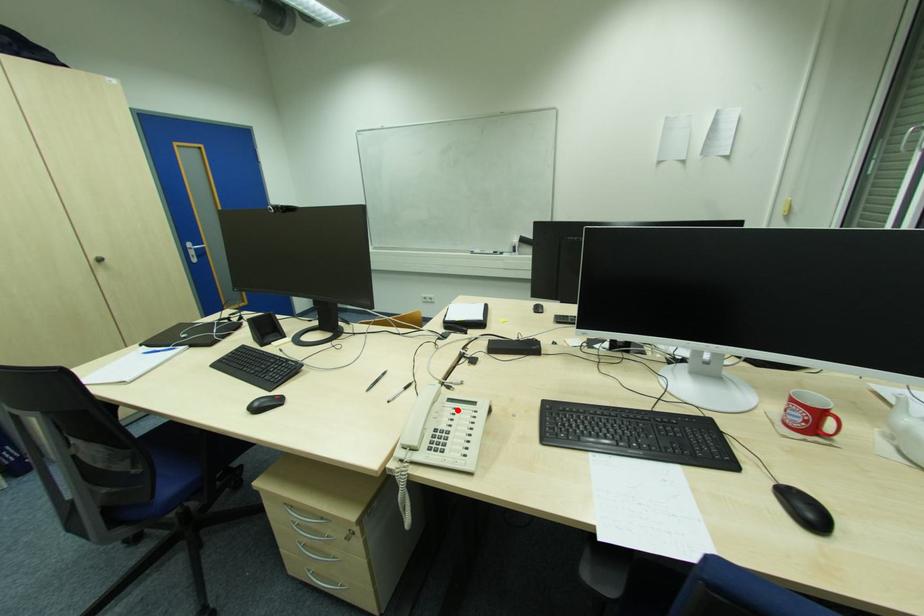
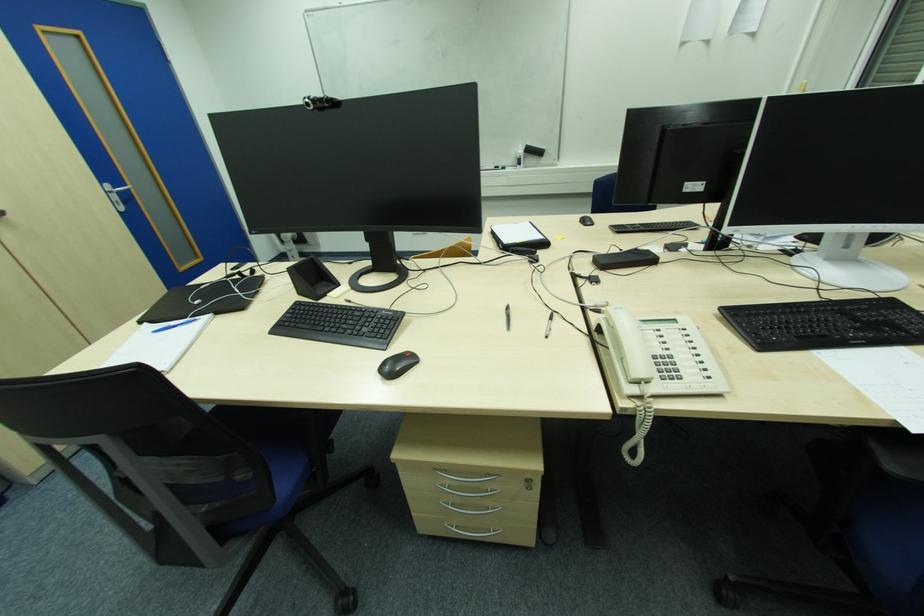
In the second image, find the point that corresponds to the highlighted location in the first image.

(661, 331)